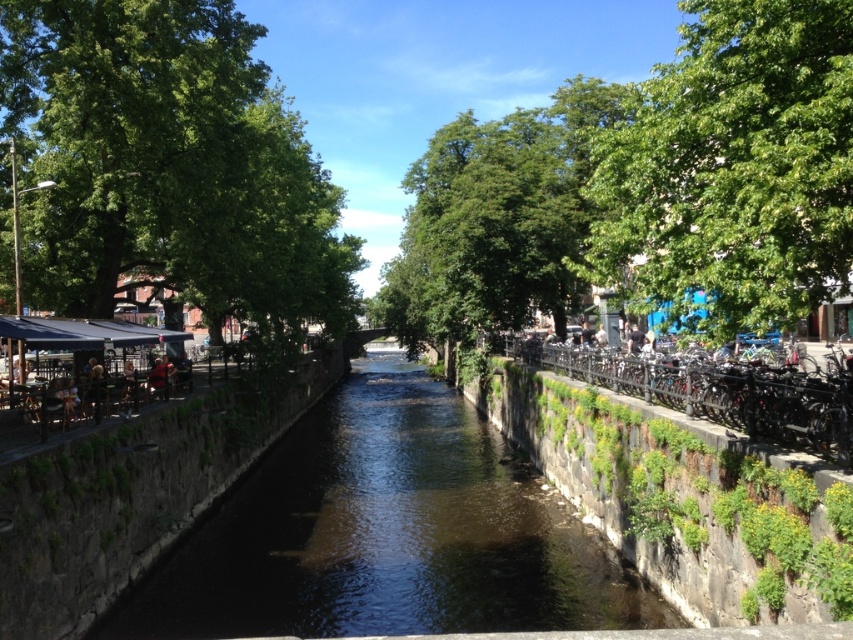
You are standing at the center of the canal and want to walk to both the green leafy tree at left and the green leafy tree at upper right. Which tree will require you to walk a shorter distance?

The green leafy tree at left is 20.02 meters away from the green leafy tree at upper right. Since you are at the center of the canal, the distance to each tree would depend on their positions. However, the question states the distance between the two trees is 20.02 meters. Without additional information about their exact positions relative to the center, it is impossible to determine which is closer. Therefore, the answer cannot be definitively determined with the given information.